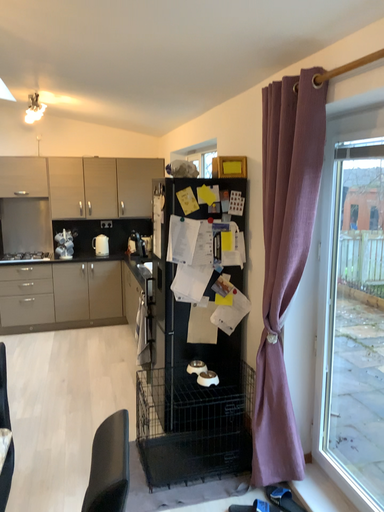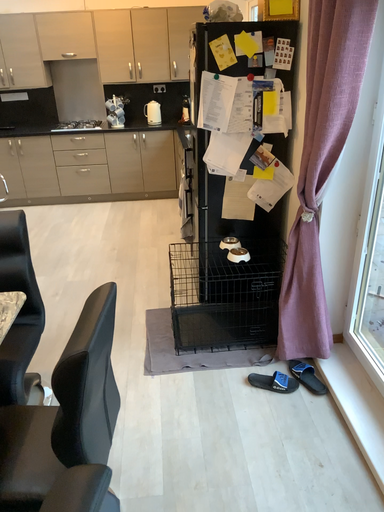
Question: How did the camera likely rotate when shooting the video?

Choices:
 (A) rotated downward
 (B) rotated upward

Answer: (A)